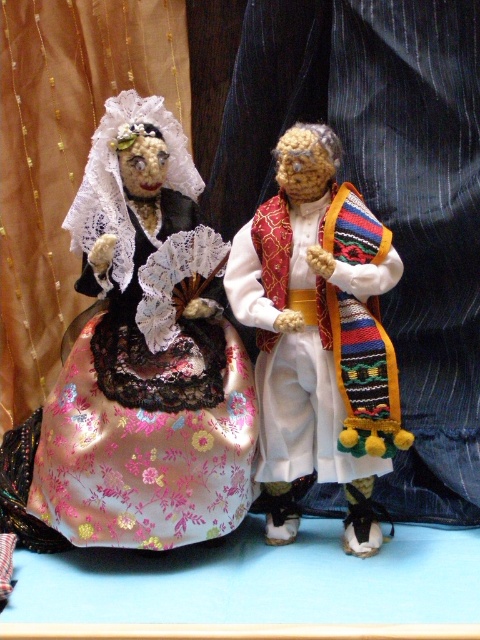
Who is positioned more to the right, silky floral dress at center or knitted woolen doll at center?

Positioned to the right is knitted woolen doll at center.

Is silky floral dress at center to the left of knitted woolen doll at center from the viewer's perspective?

Correct, you'll find silky floral dress at center to the left of knitted woolen doll at center.

In order to click on silky floral dress at center in this screenshot , I will do `click(146, 355)`.